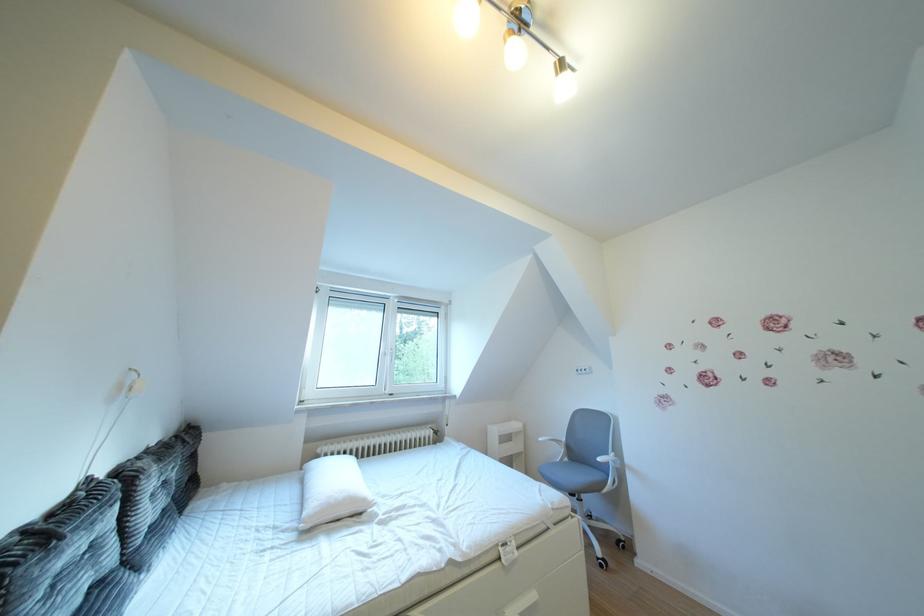
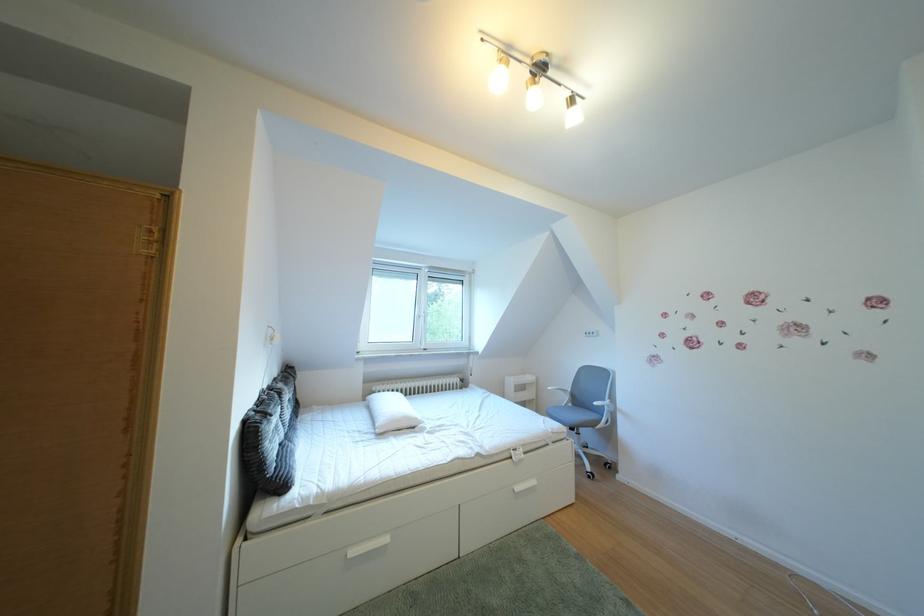
Question: Which direction would the cameraman need to move to produce the second image? Reply with the corresponding letter.

Choices:
 (A) Left
 (B) Right
 (C) Forward
 (D) Backward

Answer: (D)